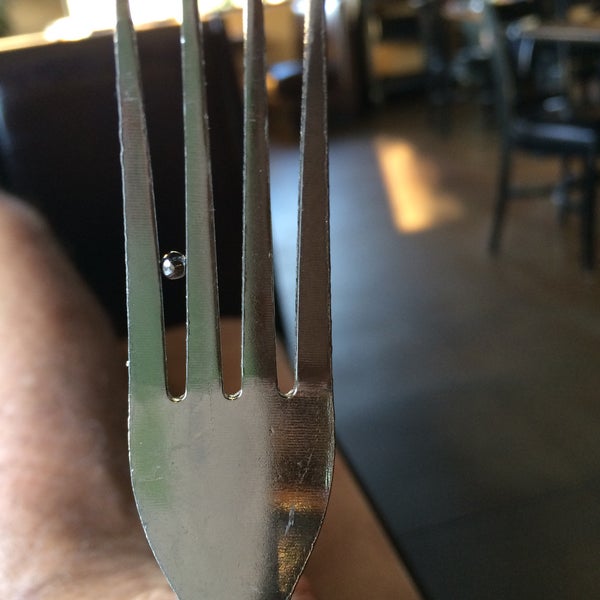
The width and height of the screenshot is (600, 600). What are the coordinates of `back right chair leg` in the screenshot? It's located at (503, 195).